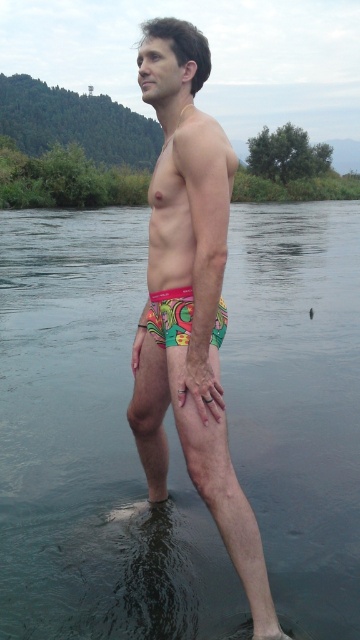
Question: Estimate the real-world distances between objects in this image. Which object is farther from the multicolored fabric shorts at center?

Choices:
 (A) clear water at lower center
 (B) vibrant printed fabric shorts at center

Answer: (A)

Question: Is clear water at lower center above vibrant printed fabric shorts at center?

Choices:
 (A) no
 (B) yes

Answer: (B)

Question: Does multicolored fabric shorts at center have a greater width compared to vibrant printed fabric shorts at center?

Choices:
 (A) no
 (B) yes

Answer: (A)

Question: Can you confirm if clear water at lower center is bigger than multicolored fabric shorts at center?

Choices:
 (A) yes
 (B) no

Answer: (A)

Question: Among these objects, which one is farthest from the camera?

Choices:
 (A) clear water at lower center
 (B) multicolored fabric shorts at center

Answer: (A)

Question: Considering the real-world distances, which object is closest to the vibrant printed fabric shorts at center?

Choices:
 (A) multicolored fabric shorts at center
 (B) clear water at lower center

Answer: (A)